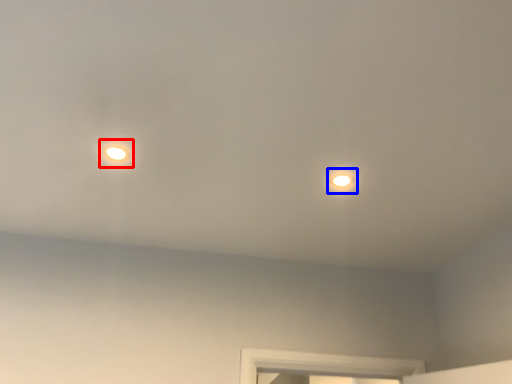
Question: Among these objects, which one is farthest to the camera, droplight (highlighted by a red box) or light (highlighted by a blue box)?

Choices:
 (A) droplight
 (B) light

Answer: (B)